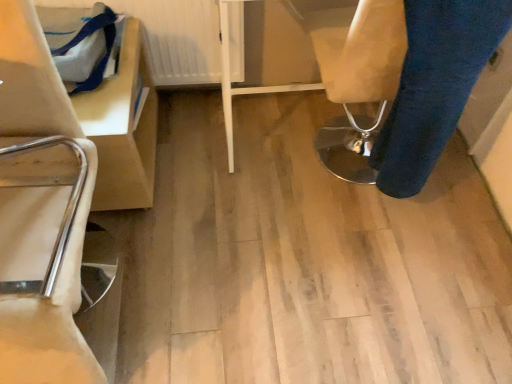
You are a GUI agent. You are given a task and a screenshot of the screen. Output one action in this format:
    pyautogui.click(x=<x>, y=<y>)
    Task: Click on the blue denim trousers at lower right
    The image size is (512, 384).
    Given the screenshot: What is the action you would take?
    pyautogui.click(x=434, y=85)

Measure the distance between point (418, 36) and camera.

37.60 inches.

The height and width of the screenshot is (384, 512). Describe the element at coordinates (434, 85) in the screenshot. I see `blue denim trousers at lower right` at that location.

Image resolution: width=512 pixels, height=384 pixels. Describe the element at coordinates (170, 36) in the screenshot. I see `white textured radiator at upper left` at that location.

Locate an element on the screen. white textured radiator at upper left is located at coordinates (170, 36).

This screenshot has height=384, width=512. I want to click on blue denim trousers at lower right, so click(434, 85).

Is blue denim trousers at lower right at the left side of white textured radiator at upper left?

In fact, blue denim trousers at lower right is to the right of white textured radiator at upper left.

Relative to white textured radiator at upper left, is blue denim trousers at lower right in front or behind?

blue denim trousers at lower right is positioned closer to the viewer than white textured radiator at upper left.

Which is further, (385, 149) or (234, 75)?

The point (234, 75) is behind.

From the image's perspective, who appears lower, blue denim trousers at lower right or white textured radiator at upper left?

blue denim trousers at lower right, from the image's perspective.

Looking at this image, from a real-world perspective, is blue denim trousers at lower right on top of white textured radiator at upper left?

Yes.

Based on the photo, does blue denim trousers at lower right have a lesser width compared to white textured radiator at upper left?

No.

Considering the relative sizes of blue denim trousers at lower right and white textured radiator at upper left in the image provided, is blue denim trousers at lower right shorter than white textured radiator at upper left?

No.

Between blue denim trousers at lower right and white textured radiator at upper left, which one has larger size?

Bigger between the two is blue denim trousers at lower right.

Would you say blue denim trousers at lower right is outside white textured radiator at upper left?

blue denim trousers at lower right is positioned outside white textured radiator at upper left.

Is blue denim trousers at lower right with white textured radiator at upper left?

No.

Looking at this image, is blue denim trousers at lower right oriented towards white textured radiator at upper left?

No, blue denim trousers at lower right is not facing towards white textured radiator at upper left.

How distant is blue denim trousers at lower right from white textured radiator at upper left?

A distance of 30.55 inches exists between blue denim trousers at lower right and white textured radiator at upper left.

There is a white textured radiator at upper left. Identify the location of trousers above it (from a real-world perspective). (434, 85).

Would you say white textured radiator at upper left is to the left or to the right of blue denim trousers at lower right in the picture?

Based on their positions, white textured radiator at upper left is located to the left of blue denim trousers at lower right.

Relative to blue denim trousers at lower right, is white textured radiator at upper left in front or behind?

Clearly, white textured radiator at upper left is behind blue denim trousers at lower right.

Is point (172, 27) positioned after point (500, 16)?

Yes, it is.

From the image's perspective, is white textured radiator at upper left above blue denim trousers at lower right?

Correct, white textured radiator at upper left appears higher than blue denim trousers at lower right in the image.

From a real-world perspective, relative to blue denim trousers at lower right, is white textured radiator at upper left vertically above or below?

white textured radiator at upper left is below blue denim trousers at lower right.

From the picture: Considering the sizes of white textured radiator at upper left and blue denim trousers at lower right in the image, is white textured radiator at upper left wider or thinner than blue denim trousers at lower right?

Considering their sizes, white textured radiator at upper left looks slimmer than blue denim trousers at lower right.

Considering the relative sizes of white textured radiator at upper left and blue denim trousers at lower right in the image provided, is white textured radiator at upper left shorter than blue denim trousers at lower right?

Yes.

Considering the relative sizes of white textured radiator at upper left and blue denim trousers at lower right in the image provided, is white textured radiator at upper left bigger than blue denim trousers at lower right?

No.

Is blue denim trousers at lower right surrounded by white textured radiator at upper left?

Definitely not — blue denim trousers at lower right is not inside white textured radiator at upper left.

Are white textured radiator at upper left and blue denim trousers at lower right located far from each other?

No, there isn't a large distance between white textured radiator at upper left and blue denim trousers at lower right.

Is white textured radiator at upper left turned away from blue denim trousers at lower right?

No, white textured radiator at upper left is not facing away from blue denim trousers at lower right.

The image size is (512, 384). In order to click on trousers above the white textured radiator at upper left (from a real-world perspective) in this screenshot , I will do coord(434,85).

The width and height of the screenshot is (512, 384). Identify the location of trousers on the right of white textured radiator at upper left. pos(434,85).

Image resolution: width=512 pixels, height=384 pixels. Identify the location of radiator located underneath the blue denim trousers at lower right (from a real-world perspective). (170, 36).